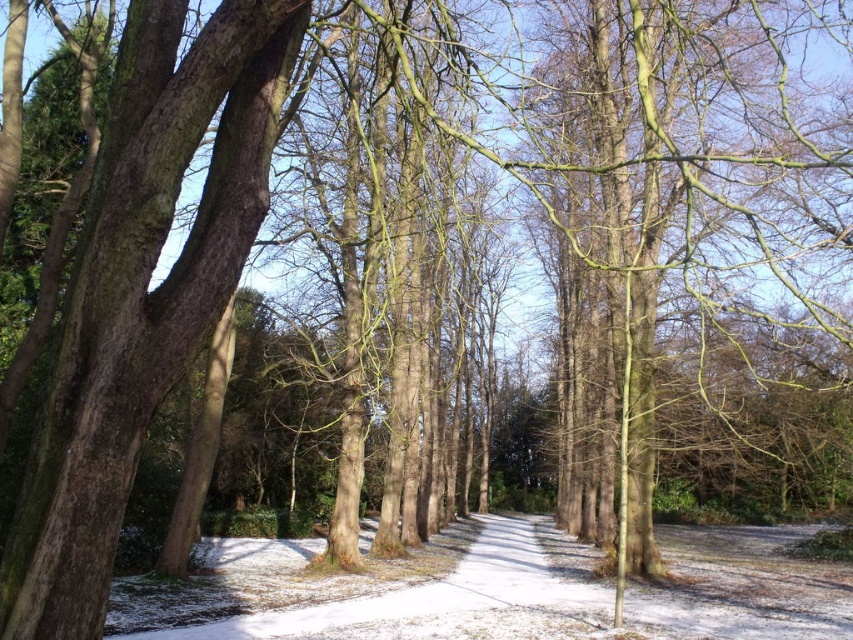
You are standing on the path in the winter scene. You see two points marked in the image. Which point is closer to you, point (25, 536) or point (598, 611)?

Point (25, 536) is closer to the viewer than point (598, 611).